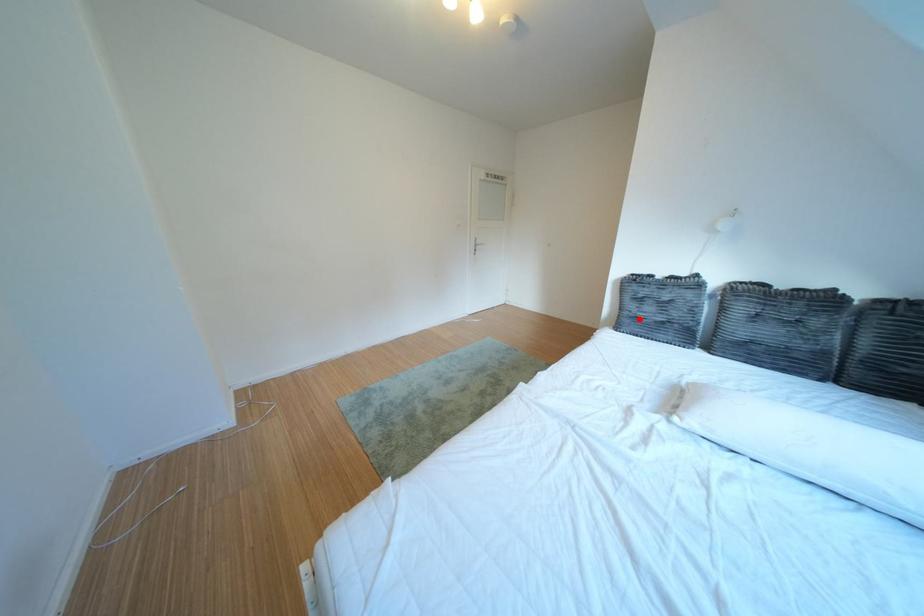
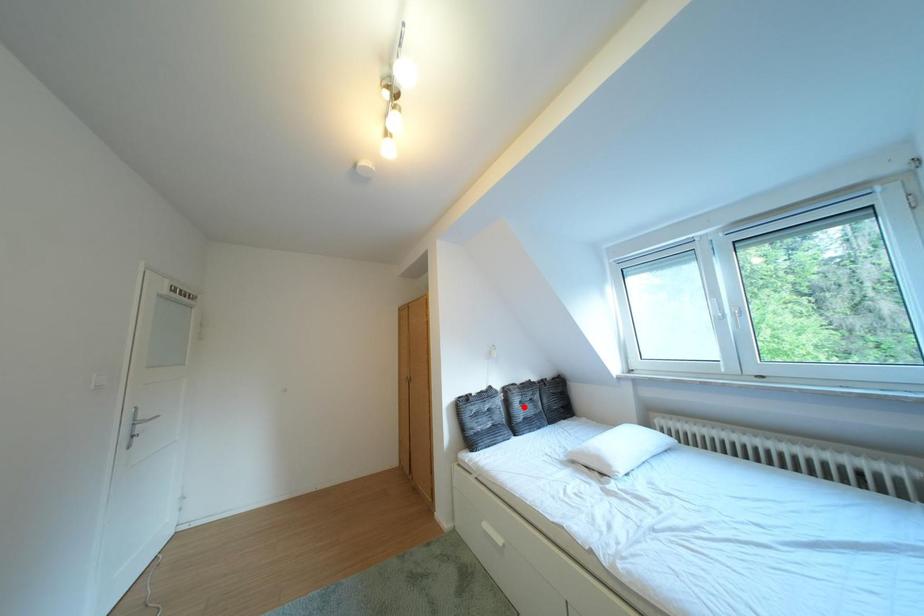
I am providing you with two images of the same scene from different viewpoints. A red point is marked on the first image and another point is marked on the second image. Does the point marked in image1 correspond to the same location as the one in image2?

No